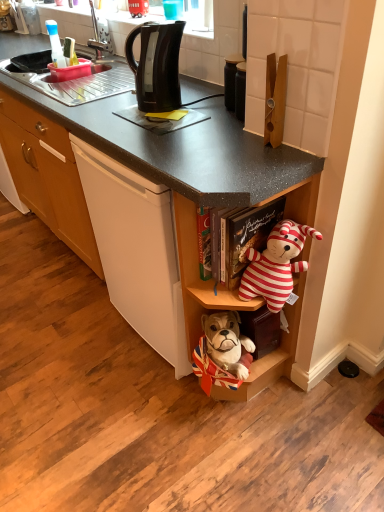
Question: Does striped fabric teddy bear at center-right have a smaller size compared to black plastic kettle at upper center?

Choices:
 (A) no
 (B) yes

Answer: (A)

Question: Is striped fabric teddy bear at center-right thinner than black plastic kettle at upper center?

Choices:
 (A) yes
 (B) no

Answer: (B)

Question: Does striped fabric teddy bear at center-right turn towards black plastic kettle at upper center?

Choices:
 (A) no
 (B) yes

Answer: (A)

Question: Is striped fabric teddy bear at center-right positioned far away from black plastic kettle at upper center?

Choices:
 (A) yes
 (B) no

Answer: (B)

Question: From a real-world perspective, is striped fabric teddy bear at center-right positioned under black plastic kettle at upper center based on gravity?

Choices:
 (A) yes
 (B) no

Answer: (A)

Question: Is black matte jar at upper center in front of or behind black plastic kettle at center in the image?

Choices:
 (A) behind
 (B) front

Answer: (A)

Question: Is point (228, 73) positioned closer to the camera than point (119, 212)?

Choices:
 (A) closer
 (B) farther

Answer: (B)

Question: Is black matte jar at upper center inside the boundaries of black plastic kettle at center, or outside?

Choices:
 (A) inside
 (B) outside

Answer: (B)

Question: From their relative heights in the image, would you say black matte jar at upper center is taller or shorter than black plastic kettle at center?

Choices:
 (A) tall
 (B) short

Answer: (B)

Question: Based on their sizes in the image, would you say black plastic kettle at center is bigger or smaller than wooden shelf at lower center?

Choices:
 (A) big
 (B) small

Answer: (A)

Question: From the image's perspective, relative to wooden shelf at lower center, is black plastic kettle at center above or below?

Choices:
 (A) above
 (B) below

Answer: (A)

Question: Considering the relative positions of black plastic kettle at center and wooden shelf at lower center in the image provided, is black plastic kettle at center to the left or to the right of wooden shelf at lower center?

Choices:
 (A) right
 (B) left

Answer: (B)

Question: Do you think black plastic kettle at center is within wooden shelf at lower center, or outside of it?

Choices:
 (A) inside
 (B) outside

Answer: (B)

Question: Relative to black matte jar at upper center, is striped fabric teddy bear at center-right in front or behind?

Choices:
 (A) behind
 (B) front

Answer: (B)

Question: Looking at the image, does striped fabric teddy bear at center-right seem bigger or smaller compared to black matte jar at upper center?

Choices:
 (A) small
 (B) big

Answer: (B)